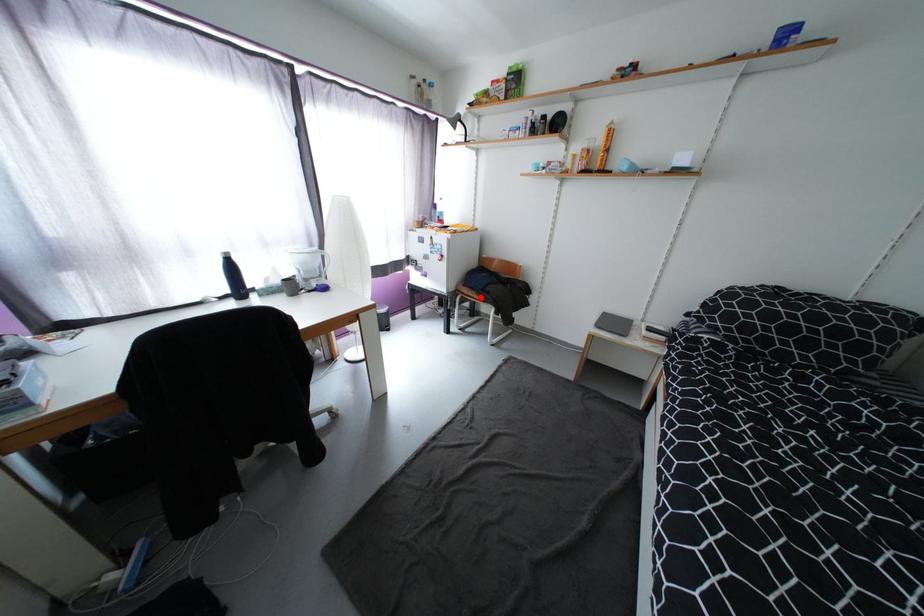
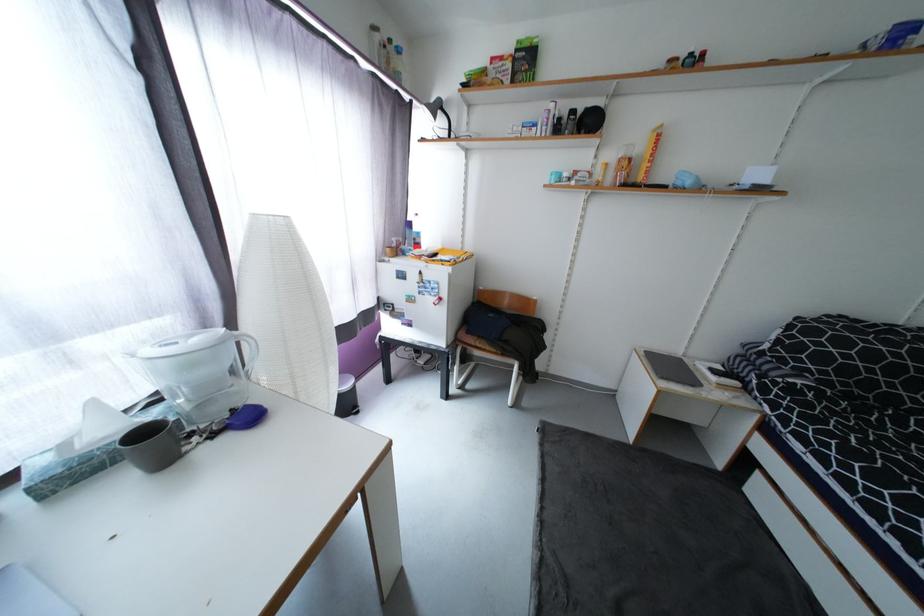
Question: I am providing you with two images of the same scene from different viewpoints. Given a red point in image1, look at the same physical point in image2. Is it:

Choices:
 (A) Closer to the viewpoint
 (B) Farther from the viewpoint

Answer: (B)